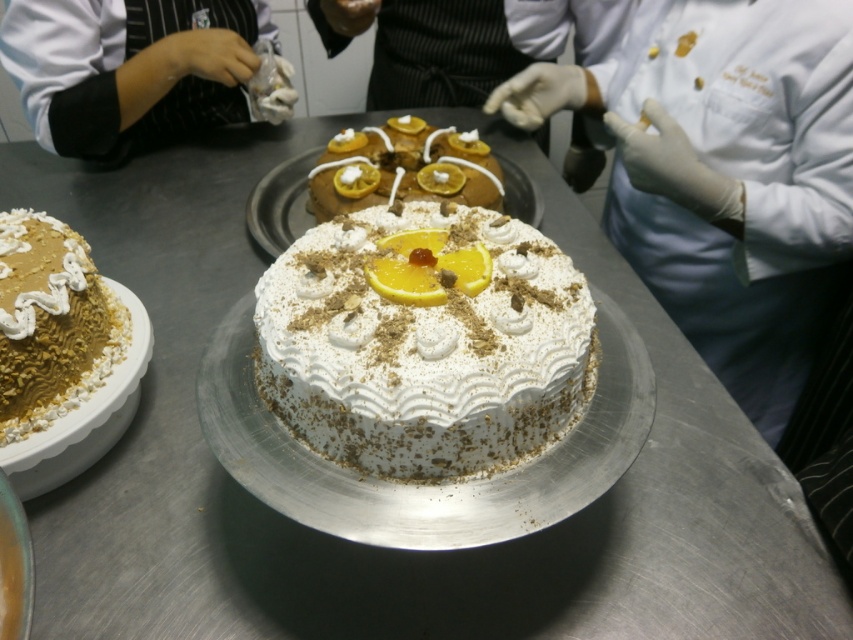
What is the position of the point with coordinates [51,323] in relation to the golden textured dome at left?

The point with coordinates [51,323] is located on the golden textured dome at left.

You are a customer at a bakery and want to order the cake that is placed exactly at the center of the image. Which cake should you choose between the white cream cake at center and the golden brown cake in the background?

The white cream cake at center is located at the center of the image according to its coordinates, so you should choose the white cream cake at center.